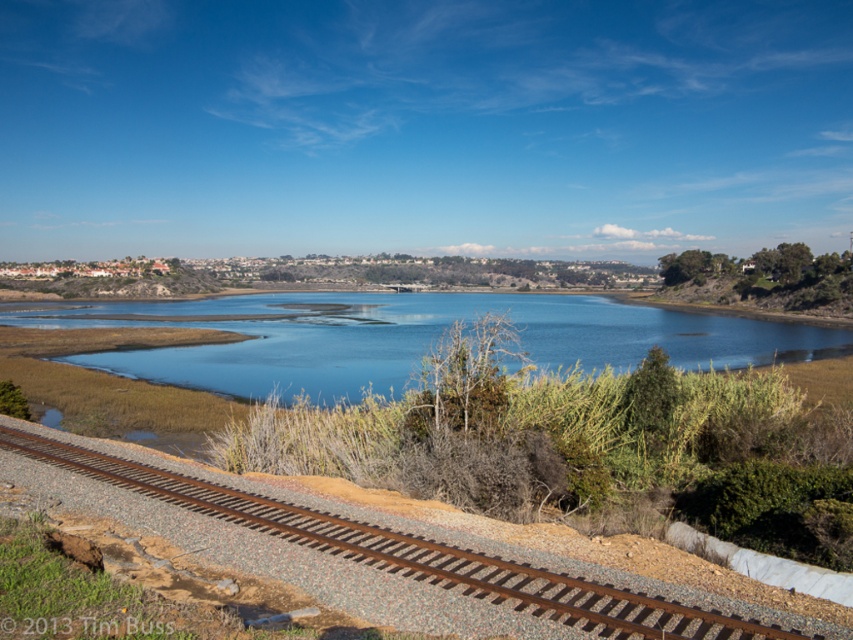
Which is more to the right, blue water at center or rusty metal track at lower left?

From the viewer's perspective, rusty metal track at lower left appears more on the right side.

Between blue water at center and rusty metal track at lower left, which one has less height?

With less height is rusty metal track at lower left.

Does point (612, 364) lie in front of point (314, 512)?

That is False.

You are a GUI agent. You are given a task and a screenshot of the screen. Output one action in this format:
    pyautogui.click(x=<x>, y=<y>)
    Task: Click on the blue water at center
    
    Given the screenshot: What is the action you would take?
    pyautogui.click(x=412, y=337)